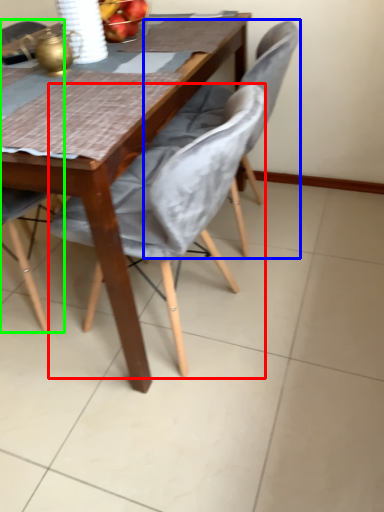
Question: Considering the real-world distances, which object is farthest from chair (highlighted by a red box)? chair (highlighted by a blue box) or chair (highlighted by a green box)?

Choices:
 (A) chair
 (B) chair

Answer: (B)